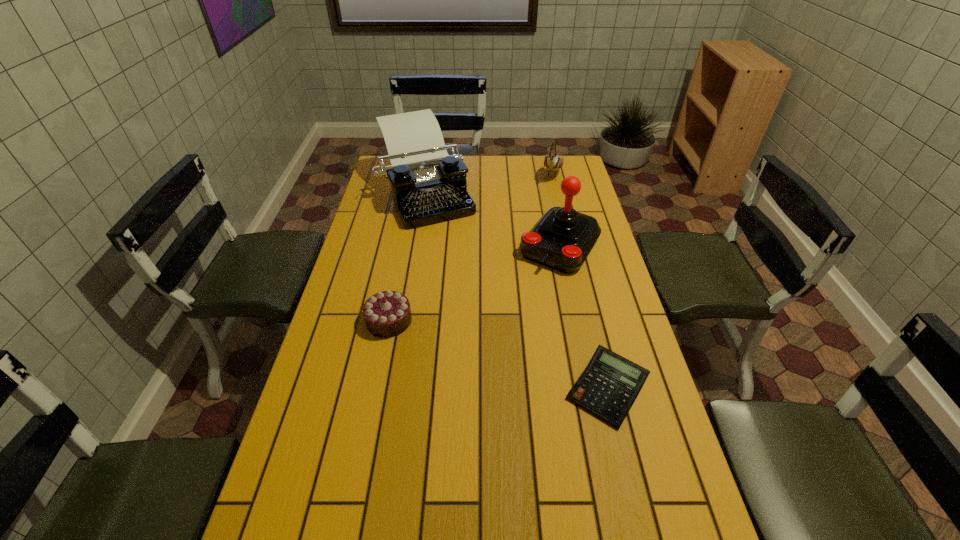
Locate an element on the screen. The width and height of the screenshot is (960, 540). vacant area that lies between the typewriter and the bird is located at coordinates (490, 182).

Locate an element on the screen. The width and height of the screenshot is (960, 540). vacant space in between the typewriter and the shortest object is located at coordinates [x=516, y=290].

You are a GUI agent. You are given a task and a screenshot of the screen. Output one action in this format:
    pyautogui.click(x=<x>, y=<y>)
    Task: Click on the object that is the fourth closest to the chocolate cake
    Image resolution: width=960 pixels, height=540 pixels.
    Given the screenshot: What is the action you would take?
    pyautogui.click(x=552, y=162)

Identify the location of the fourth closest object relative to the typewriter. (608, 387).

The width and height of the screenshot is (960, 540). In order to click on free space that satisfies the following two spatial constraints: 1. on the front side of the calculator; 2. on the right side of the typewriter in this screenshot , I will do [x=395, y=389].

Find the location of a particular element. This screenshot has height=540, width=960. vacant region that satisfies the following two spatial constraints: 1. on the back side of the bird; 2. on the left side of the typewriter is located at coordinates (430, 173).

You are a GUI agent. You are given a task and a screenshot of the screen. Output one action in this format:
    pyautogui.click(x=<x>, y=<y>)
    Task: Click on the vacant point that satisfies the following two spatial constraints: 1. on the front side of the joystick; 2. on the right side of the shortest object
    Image resolution: width=960 pixels, height=540 pixels.
    Given the screenshot: What is the action you would take?
    pyautogui.click(x=590, y=389)

Locate an element on the screen. The width and height of the screenshot is (960, 540). free location that satisfies the following two spatial constraints: 1. on the front side of the nearest object; 2. on the left side of the typewriter is located at coordinates (395, 389).